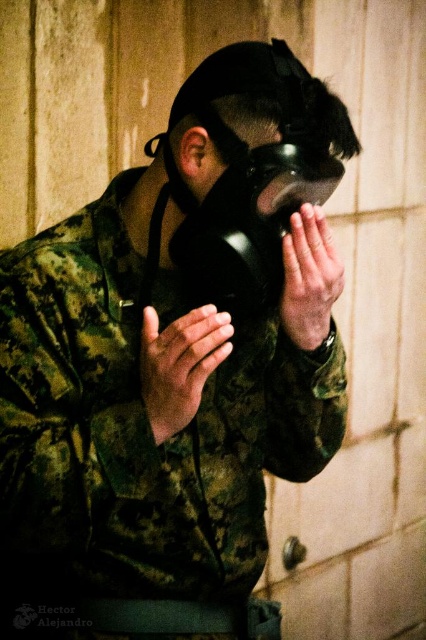
You are a photographer standing at the camera position. You need to take a photo of the gas mask worn by the person in the scene. The focus point of your camera is set to point [169,360]. The minimum focus distance of your camera is 30 inches. Can you focus on the gas mask using this focus point?

The distance between point [169,360] and the camera is 39.31 inches. Since this distance is greater than the minimum focus distance of 30 inches, the camera can focus on the gas mask at that point.